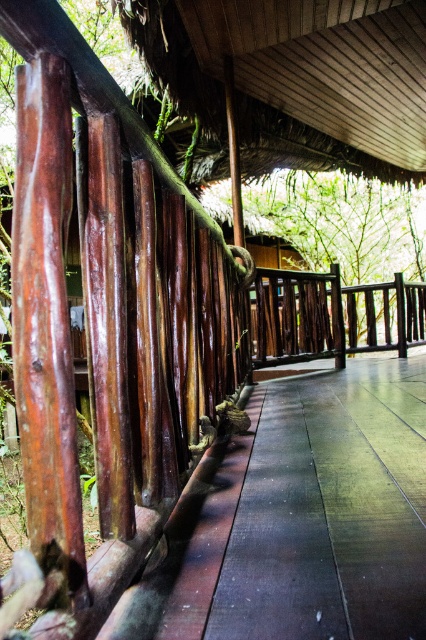
Which is behind, point (293, 548) or point (226, 182)?

The point (226, 182) is behind.

Which is more to the left, brown wooden path at center or green leafy tree at center?

brown wooden path at center is more to the left.

Is point (362, 577) positioned before point (400, 230)?

Yes, it is.

In order to click on brown wooden path at center in this screenshot , I will do 301,516.

Between green leafy tree at center and dark brown wood rail at center, which one appears on the right side from the viewer's perspective?

green leafy tree at center is more to the right.

Which is in front, point (396, 268) or point (267, 314)?

Positioned in front is point (267, 314).

At what (x,y) coordinates should I click in order to perform the action: click on green leafy tree at center. Please return your answer as a coordinate pair (x, y). This screenshot has width=426, height=640. Looking at the image, I should click on point(342,221).

From the picture: Is brown wooden path at center to the left of brown/thatched roof at upper center from the viewer's perspective?

Indeed, brown wooden path at center is positioned on the left side of brown/thatched roof at upper center.

Does brown wooden path at center have a greater width compared to brown/thatched roof at upper center?

In fact, brown wooden path at center might be narrower than brown/thatched roof at upper center.

Describe the element at coordinates (301, 516) in the screenshot. I see `brown wooden path at center` at that location.

Locate an element on the screen. The image size is (426, 640). brown wooden path at center is located at coordinates (301, 516).